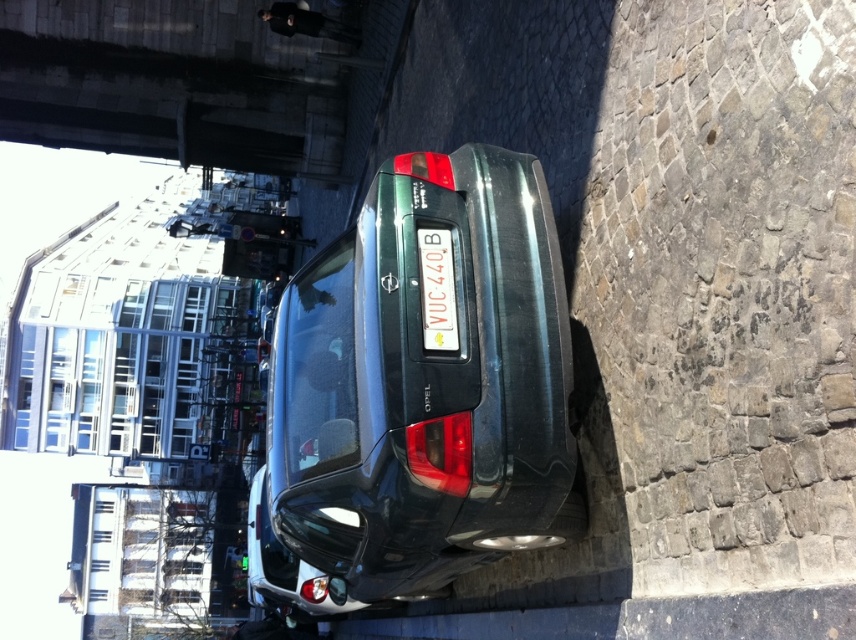
Can you confirm if concrete bridge at upper left is positioned to the right of white plastic license plate at center?

No, concrete bridge at upper left is not to the right of white plastic license plate at center.

Between concrete bridge at upper left and white plastic license plate at center, which one is positioned lower?

Positioned lower is white plastic license plate at center.

The width and height of the screenshot is (856, 640). What do you see at coordinates (177, 83) in the screenshot?
I see `concrete bridge at upper left` at bounding box center [177, 83].

Identify the location of concrete bridge at upper left. (177, 83).

Does metallic green car at center lie behind glassy transparent building at upper left?

No, it is in front of glassy transparent building at upper left.

Is metallic green car at center thinner than glassy transparent building at upper left?

Correct, metallic green car at center's width is less than glassy transparent building at upper left's.

Who is more distant from viewer, (x=348, y=243) or (x=33, y=445)?

Positioned behind is point (x=33, y=445).

In order to click on metallic green car at center in this screenshot , I will do `click(425, 385)`.

Does metallic green car at center have a lesser width compared to concrete bridge at upper left?

No.

Is point (301, 268) closer to camera compared to point (117, 141)?

No, (301, 268) is further to viewer.

The width and height of the screenshot is (856, 640). I want to click on metallic green car at center, so click(x=425, y=385).